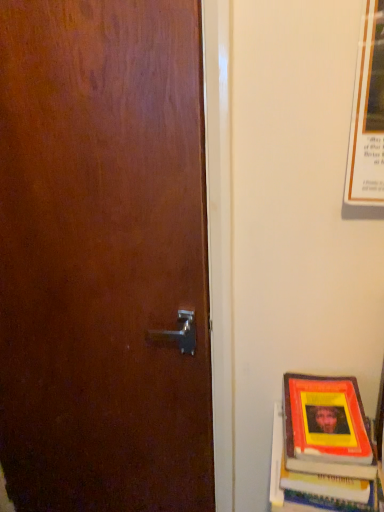
In order to face matte paper poster at upper right, should I rotate leftwards or rightwards?

To align with it, rotate right about 32.741°.

This screenshot has height=512, width=384. Describe the element at coordinates (368, 114) in the screenshot. I see `matte paper poster at upper right` at that location.

Image resolution: width=384 pixels, height=512 pixels. Find the location of `matte paper poster at upper right`. matte paper poster at upper right is located at coordinates (368, 114).

Consider the image. What is the approximate width of matte paper poster at upper right?

matte paper poster at upper right is 1.70 inches wide.

This screenshot has width=384, height=512. Identify the location of yellow matte book at lower right. (309, 478).

Describe the element at coordinates (309, 478) in the screenshot. I see `yellow matte book at lower right` at that location.

The width and height of the screenshot is (384, 512). In order to click on matte paper poster at upper right in this screenshot , I will do (x=368, y=114).

Which object is positioned more to the left, matte paper poster at upper right or yellow matte book at lower right?

Positioned to the left is yellow matte book at lower right.

In the scene shown: Which object is closer to the camera, matte paper poster at upper right or yellow matte book at lower right?

matte paper poster at upper right is closer to the camera.

Which point is more distant from viewer, (366, 75) or (347, 505)?

The point (347, 505) is farther.

From the image's perspective, is matte paper poster at upper right over yellow matte book at lower right?

Correct, matte paper poster at upper right appears higher than yellow matte book at lower right in the image.

From a real-world perspective, is matte paper poster at upper right located beneath yellow matte book at lower right?

No, from a real-world perspective, matte paper poster at upper right is not below yellow matte book at lower right.

Is matte paper poster at upper right wider or thinner than yellow matte book at lower right?

matte paper poster at upper right is thinner than yellow matte book at lower right.

Considering the sizes of objects matte paper poster at upper right and yellow matte book at lower right in the image provided, who is shorter, matte paper poster at upper right or yellow matte book at lower right?

yellow matte book at lower right.

Considering the sizes of objects matte paper poster at upper right and yellow matte book at lower right in the image provided, who is smaller, matte paper poster at upper right or yellow matte book at lower right?

Smaller between the two is matte paper poster at upper right.

Is yellow matte book at lower right completely or partially inside matte paper poster at upper right?

No, yellow matte book at lower right is located outside of matte paper poster at upper right.

Would you consider matte paper poster at upper right to be distant from yellow matte book at lower right?

Actually, matte paper poster at upper right and yellow matte book at lower right are a little close together.

From the picture: Is yellow matte book at lower right at the back of matte paper poster at upper right?

matte paper poster at upper right does not have its back to yellow matte book at lower right.

Measure the distance from matte paper poster at upper right to yellow matte book at lower right.

matte paper poster at upper right is 20.71 inches from yellow matte book at lower right.

This screenshot has height=512, width=384. I want to click on book behind the matte paper poster at upper right, so click(309, 478).

Between yellow matte book at lower right and matte paper poster at upper right, which one appears on the right side from the viewer's perspective?

Result: matte paper poster at upper right is more to the right.

Is the depth of yellow matte book at lower right greater than that of matte paper poster at upper right?

That is True.

Is point (285, 484) positioned before point (372, 14)?

No, (285, 484) is behind (372, 14).

From the image's perspective, which object appears higher, yellow matte book at lower right or matte paper poster at upper right?

matte paper poster at upper right.

From a real-world perspective, is yellow matte book at lower right above or below matte paper poster at upper right?

From a real-world perspective, yellow matte book at lower right is physically below matte paper poster at upper right.

Considering the sizes of objects yellow matte book at lower right and matte paper poster at upper right in the image provided, who is wider, yellow matte book at lower right or matte paper poster at upper right?

Wider between the two is yellow matte book at lower right.

Can you confirm if yellow matte book at lower right is shorter than matte paper poster at upper right?

Indeed, yellow matte book at lower right has a lesser height compared to matte paper poster at upper right.

Can you confirm if yellow matte book at lower right is smaller than matte paper poster at upper right?

No.

Would you say yellow matte book at lower right contains matte paper poster at upper right?

Actually, matte paper poster at upper right is outside yellow matte book at lower right.

Are yellow matte book at lower right and matte paper poster at upper right far apart?

No, there isn't a large distance between yellow matte book at lower right and matte paper poster at upper right.

Is yellow matte book at lower right turned away from matte paper poster at upper right?

That's not correct — yellow matte book at lower right is not looking away from matte paper poster at upper right.

What's the angular difference between yellow matte book at lower right and matte paper poster at upper right's facing directions?

The angle between the facing direction of yellow matte book at lower right and the facing direction of matte paper poster at upper right is 2.67 degrees.

Locate an element on the screen. The height and width of the screenshot is (512, 384). poster to the right of yellow matte book at lower right is located at coordinates (368, 114).

At what (x,y) coordinates should I click in order to perform the action: click on book behind the matte paper poster at upper right. Please return your answer as a coordinate pair (x, y). The image size is (384, 512). Looking at the image, I should click on (309, 478).

You are a GUI agent. You are given a task and a screenshot of the screen. Output one action in this format:
    pyautogui.click(x=<x>, y=<y>)
    Task: Click on the book below the matte paper poster at upper right (from the image's perspective)
    This screenshot has height=512, width=384.
    Given the screenshot: What is the action you would take?
    pyautogui.click(x=309, y=478)